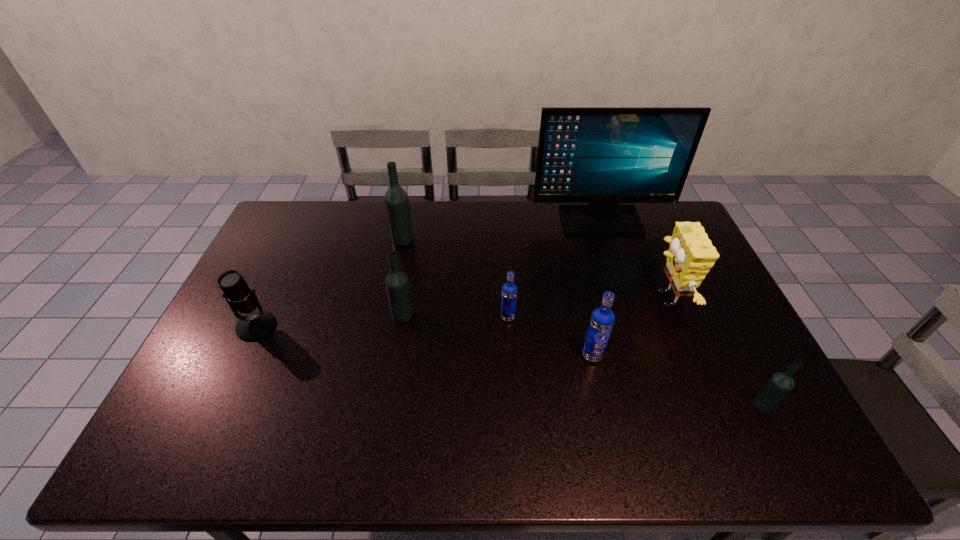
Locate an element on the screen. the left blue vodka is located at coordinates (509, 290).

This screenshot has height=540, width=960. What are the coordinates of `the nearest object` in the screenshot? It's located at (780, 384).

Identify the location of the rightmost vodka. click(x=780, y=384).

Identify the location of free space located 0.190m on the screen side of the monitor. (617, 271).

Find the location of `free space located 0.190m on the left of the biggest black vodka`. free space located 0.190m on the left of the biggest black vodka is located at coordinates (338, 239).

I want to click on vacant space located 0.050m on the front-facing side of the yellow sponge, so click(x=631, y=299).

Find the location of a particular element. The width and height of the screenshot is (960, 540). free space located 0.370m on the front-facing side of the yellow sponge is located at coordinates (527, 299).

The image size is (960, 540). In order to click on vacant region located 0.200m on the front-facing side of the yellow sponge in this screenshot , I will do `click(582, 299)`.

Locate an element on the screen. This screenshot has width=960, height=540. blank space located on the left of the bigger blue vodka is located at coordinates (527, 356).

Find the location of a particular element. This screenshot has height=540, width=960. free space located 0.360m on the left of the second smallest black vodka is located at coordinates (271, 314).